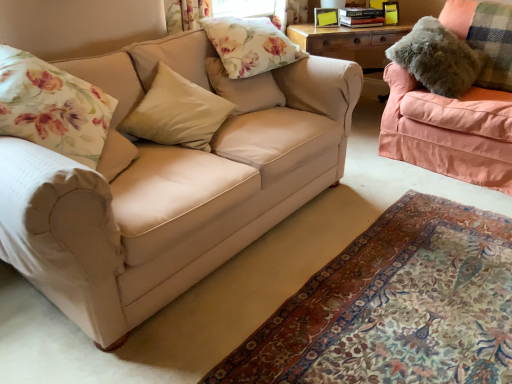
Question: Is beige fabric couch at left, positioned as the first studio couch in left-to-right order, smaller than floral fabric pillow at upper center?

Choices:
 (A) no
 (B) yes

Answer: (A)

Question: From a real-world perspective, is beige fabric couch at left, positioned as the first studio couch in left-to-right order, located beneath floral fabric pillow at upper center?

Choices:
 (A) yes
 (B) no

Answer: (A)

Question: Can you confirm if beige fabric couch at left, which appears as the 2th studio couch when viewed from the right, is positioned to the right of floral fabric pillow at upper center?

Choices:
 (A) yes
 (B) no

Answer: (B)

Question: Is beige fabric couch at left, positioned as the first studio couch in left-to-right order, oriented towards floral fabric pillow at upper center?

Choices:
 (A) no
 (B) yes

Answer: (A)

Question: Is beige fabric couch at left, positioned as the first studio couch in left-to-right order, further to the viewer compared to floral fabric pillow at upper center?

Choices:
 (A) no
 (B) yes

Answer: (A)

Question: Is point (381, 370) closer or farther from the camera than point (22, 112)?

Choices:
 (A) closer
 (B) farther

Answer: (A)

Question: From a real-world perspective, is beige fabric rug at lower center above or below floral fabric pillow at left, placed as the fourth pillow when sorted from right to left?

Choices:
 (A) below
 (B) above

Answer: (A)

Question: Is beige fabric rug at lower center inside or outside of floral fabric pillow at left, placed as the first pillow when sorted from left to right?

Choices:
 (A) outside
 (B) inside

Answer: (A)

Question: Considering the positions of beige fabric rug at lower center and floral fabric pillow at left, placed as the fourth pillow when sorted from right to left, in the image, is beige fabric rug at lower center wider or thinner than floral fabric pillow at left, placed as the fourth pillow when sorted from right to left,?

Choices:
 (A) wide
 (B) thin

Answer: (A)

Question: Is point (258, 72) closer or farther from the camera than point (136, 193)?

Choices:
 (A) closer
 (B) farther

Answer: (B)

Question: Relative to beige fabric couch at left, positioned as the first studio couch in left-to-right order, is floral fabric pillow at upper center in front or behind?

Choices:
 (A) behind
 (B) front

Answer: (A)

Question: In terms of size, does floral fabric pillow at upper center appear bigger or smaller than beige fabric couch at left, positioned as the first studio couch in left-to-right order?

Choices:
 (A) small
 (B) big

Answer: (A)

Question: Considering the positions of floral fabric pillow at upper center and beige fabric couch at left, positioned as the first studio couch in left-to-right order, in the image, is floral fabric pillow at upper center taller or shorter than beige fabric couch at left, positioned as the first studio couch in left-to-right order,?

Choices:
 (A) tall
 (B) short

Answer: (B)

Question: From a real-world perspective, is beige fabric couch at left, which appears as the 2th studio couch when viewed from the right, physically located above or below floral fabric pillow at upper center, marked as the second pillow in a right-to-left arrangement?

Choices:
 (A) above
 (B) below

Answer: (B)

Question: From the image's perspective, relative to floral fabric pillow at upper center, marked as the second pillow in a right-to-left arrangement, is beige fabric couch at left, positioned as the first studio couch in left-to-right order, above or below?

Choices:
 (A) below
 (B) above

Answer: (A)